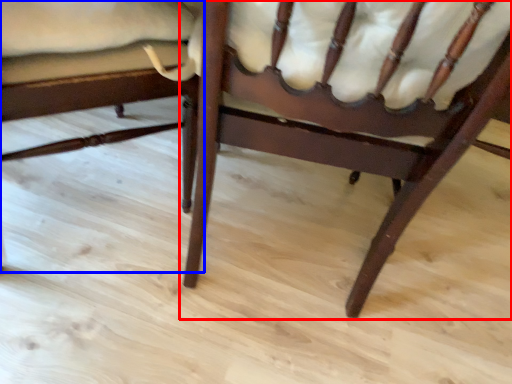
Question: Which of the following is the farthest to the observer, chair (highlighted by a red box) or chair (highlighted by a blue box)?

Choices:
 (A) chair
 (B) chair

Answer: (B)